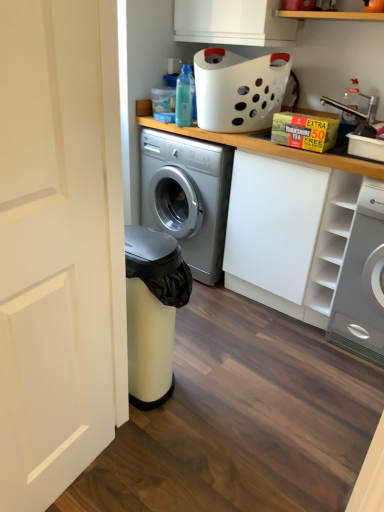
Question: Is the position of white matte cabinet at upper right less distant than that of white matte cabinet at upper right?

Choices:
 (A) yes
 (B) no

Answer: (B)

Question: Is white matte cabinet at upper right thinner than white matte cabinet at upper right?

Choices:
 (A) no
 (B) yes

Answer: (B)

Question: Is white matte cabinet at upper right touching white matte cabinet at upper right?

Choices:
 (A) yes
 (B) no

Answer: (B)

Question: Is white matte cabinet at upper right outside white matte cabinet at upper right?

Choices:
 (A) no
 (B) yes

Answer: (B)

Question: Is the position of white matte cabinet at upper right more distant than that of white matte cabinet at upper right?

Choices:
 (A) no
 (B) yes

Answer: (B)

Question: Is white matte cabinet at upper right inside or outside of translucent plastic bottle at upper center?

Choices:
 (A) outside
 (B) inside

Answer: (A)

Question: Considering the positions of white matte cabinet at upper right and translucent plastic bottle at upper center in the image, is white matte cabinet at upper right taller or shorter than translucent plastic bottle at upper center?

Choices:
 (A) short
 (B) tall

Answer: (B)

Question: From the image's perspective, is white matte cabinet at upper right located above or below translucent plastic bottle at upper center?

Choices:
 (A) below
 (B) above

Answer: (A)

Question: Based on their positions, is white matte cabinet at upper right located to the left or right of translucent plastic bottle at upper center?

Choices:
 (A) right
 (B) left

Answer: (A)

Question: Is point (369, 188) positioned closer to the camera than point (67, 146)?

Choices:
 (A) closer
 (B) farther

Answer: (B)

Question: Is white glossy washing machine at right bigger or smaller than white matte door at left?

Choices:
 (A) small
 (B) big

Answer: (B)

Question: From a real-world perspective, is white glossy washing machine at right physically located above or below white matte door at left?

Choices:
 (A) above
 (B) below

Answer: (B)

Question: In the image, is white glossy washing machine at right positioned in front of or behind white matte door at left?

Choices:
 (A) front
 (B) behind

Answer: (B)

Question: Considering the positions of point (6, 70) and point (352, 87), is point (6, 70) closer or farther from the camera than point (352, 87)?

Choices:
 (A) farther
 (B) closer

Answer: (B)

Question: From a real-world perspective, is white matte door at left physically located above or below translucent plastic bottle at upper right?

Choices:
 (A) below
 (B) above

Answer: (A)